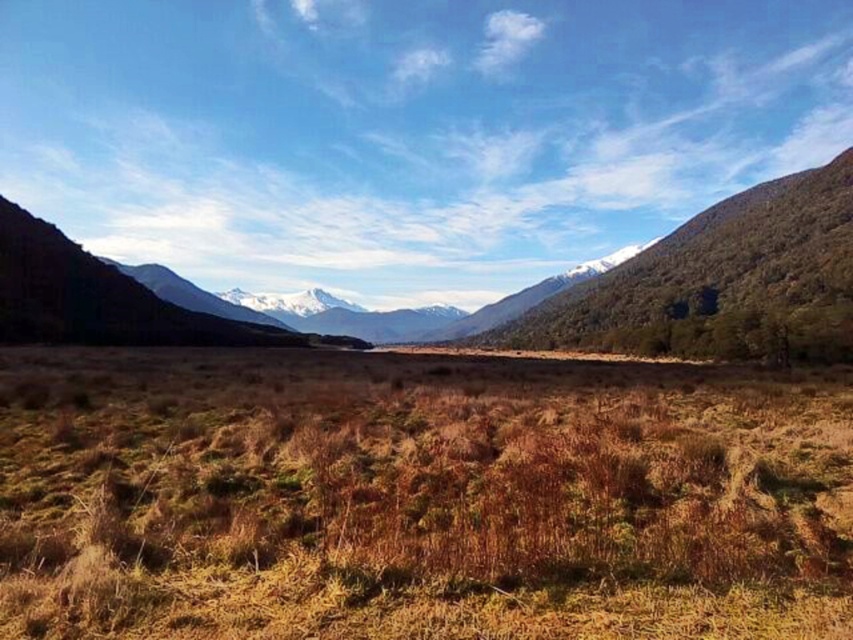
Is brown dry grass at center smaller than green grassy field at center?

Yes.

Which is behind, point (601, 467) or point (822, 212)?

Point (822, 212)

Locate an element on the screen. The width and height of the screenshot is (853, 640). brown dry grass at center is located at coordinates (419, 497).